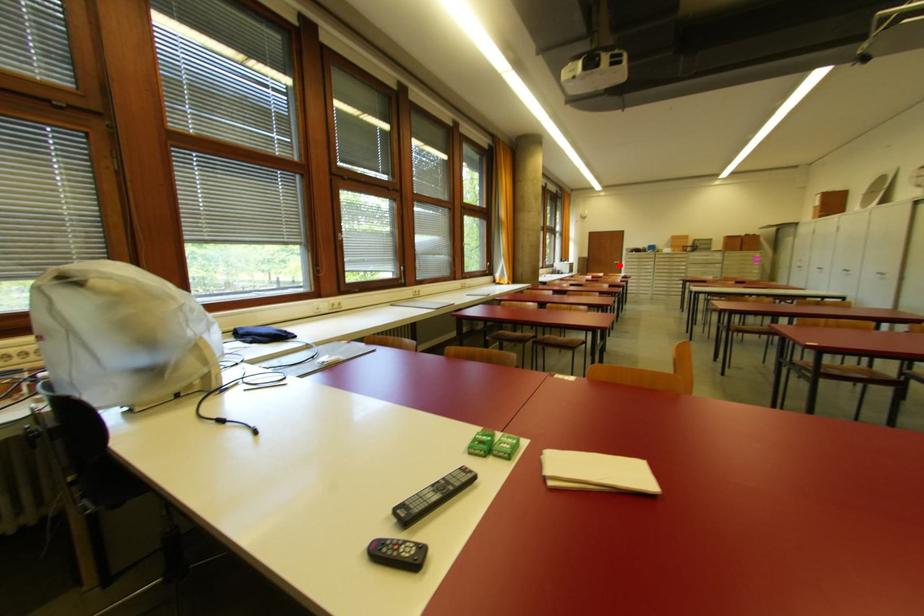
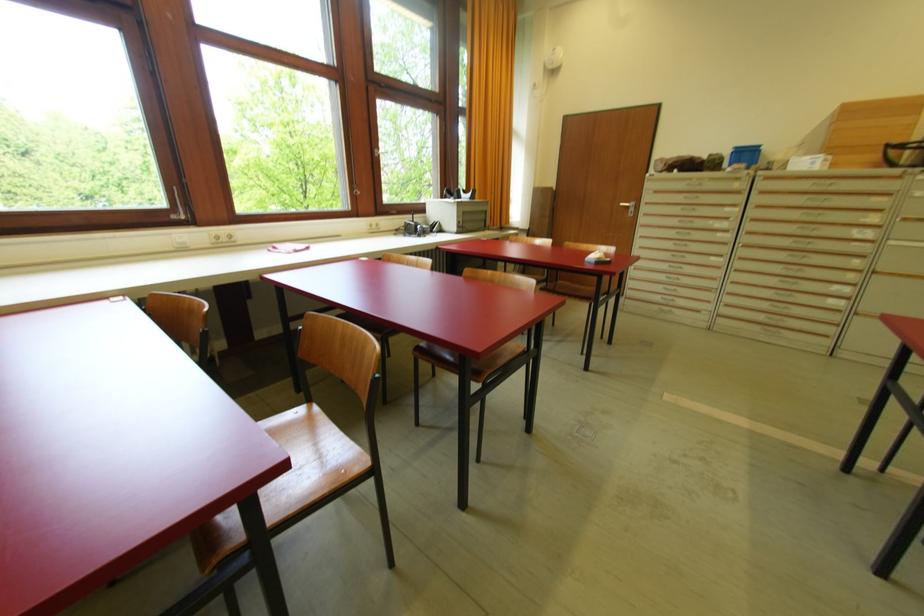
Question: I am providing you with two images of the same scene from different viewpoints. Given a red point in image1, look at the same physical point in image2. Is it:

Choices:
 (A) Closer to the viewpoint
 (B) Farther from the viewpoint

Answer: (B)